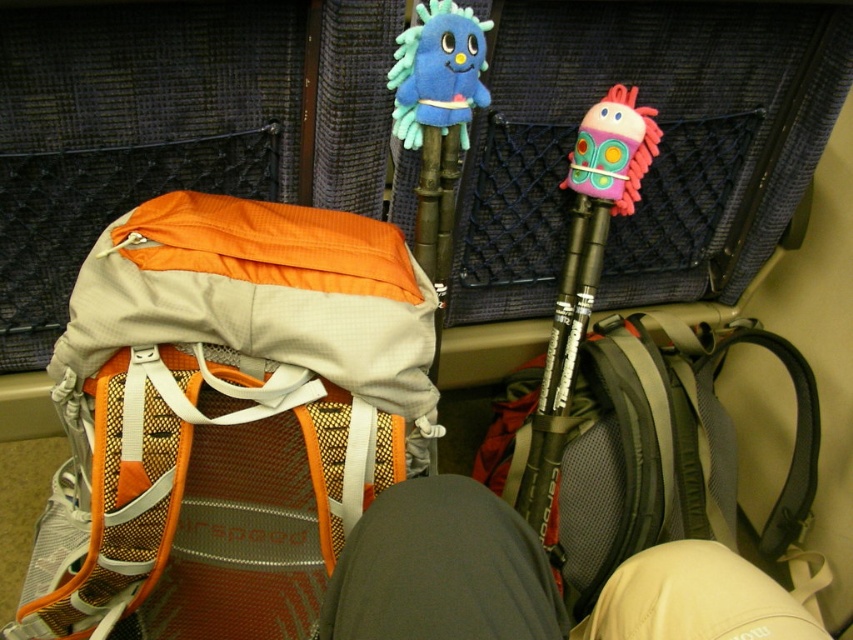
You are a traveler trying to pack your belongings into the backpack. You have two points marked on the backpack, point (450, 524) and point (595, 221). Which point is closer to you when you are facing the backpack?

Point (450, 524) is closer to the camera than point (595, 221), so the point closer to you when facing the backpack is point (450, 524).

You are packing for a hiking trip and have both the orange mesh backpack at center and the gray mesh backpack at lower right. If you want to carry more gear, which backpack should you choose based on their sizes?

The orange mesh backpack at center is much taller than the gray mesh backpack at lower right, so it can carry more gear due to its larger size.

Consider the image. You are organizing your travel items in the train compartment. You have a pink fuzzy toy at center and a blue fuzzy plush toy at upper center. Which toy is positioned lower in the scene?

The pink fuzzy toy at center is located below the blue fuzzy plush toy at upper center, so the pink fuzzy toy at center is positioned lower in the scene.